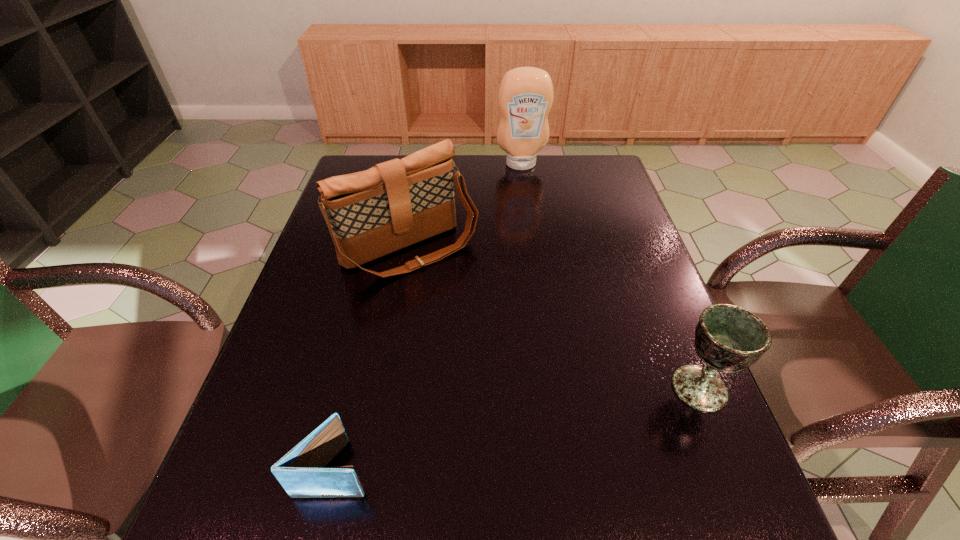
At what (x,y) coordinates should I click in order to perform the action: click on free space on the desktop that is between the shortest object and the rightmost object and is positioned on the front-facing side of the third shortest object. Please return your answer as a coordinate pair (x, y). Looking at the image, I should click on click(x=555, y=420).

At what (x,y) coordinates should I click in order to perform the action: click on vacant space on the desktop that is between the shortest object and the chalice and is positioned on the label of the farthest object. Please return your answer as a coordinate pair (x, y). The image size is (960, 540). Looking at the image, I should click on (577, 415).